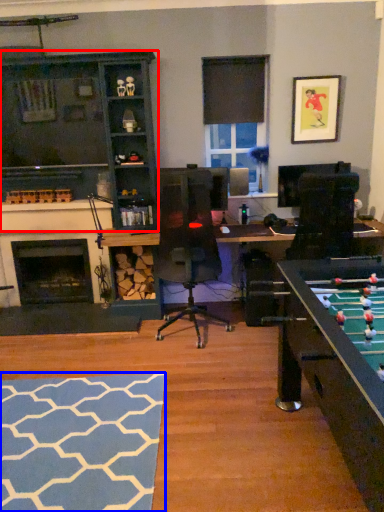
Question: Among these objects, which one is nearest to the camera, cabinetry (highlighted by a red box) or flat (highlighted by a blue box)?

Choices:
 (A) cabinetry
 (B) flat

Answer: (B)